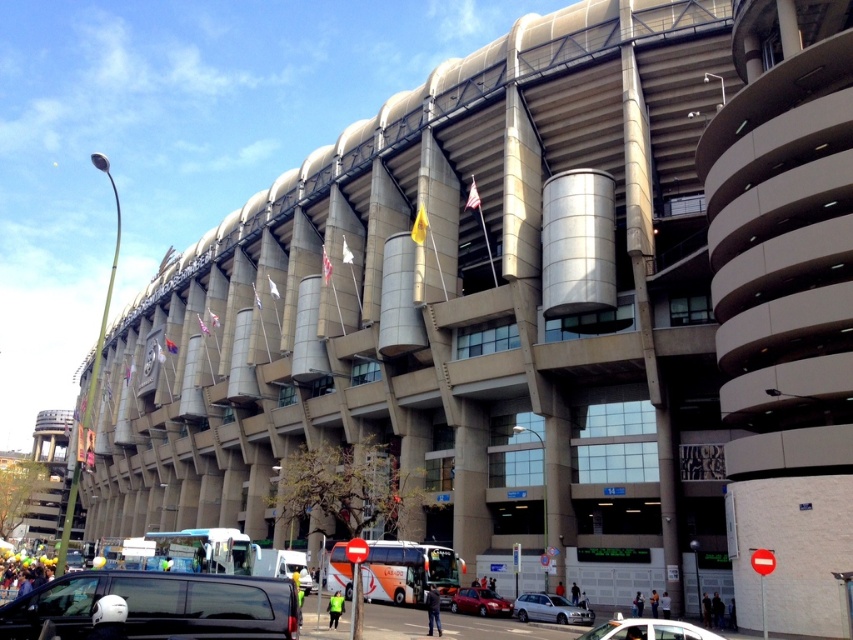
At what (x,y) coordinates should I click in order to perform the action: click on black matte van at lower left. Please return your answer as a coordinate pair (x, y). Looking at the image, I should click on (160, 605).

Is point (213, 620) positioned in front of point (538, 608)?

Yes.

Which is behind, point (82, 577) or point (575, 620)?

The point (575, 620) is behind.

Find the location of a particular element. The image size is (853, 640). black matte van at lower left is located at coordinates (x=160, y=605).

Consider the image. Is silver metallic sedan at center behind metallic red sedan at lower center?

No, it is not.

Is point (537, 616) positioned before point (473, 592)?

Yes, point (537, 616) is closer to viewer.

Find the location of `silver metallic sedan at center`. silver metallic sedan at center is located at coordinates [x=549, y=609].

Can you confirm if black matte van at lower left is positioned to the left of metallic red sedan at lower center?

Correct, you'll find black matte van at lower left to the left of metallic red sedan at lower center.

Is point (178, 602) positioned behind point (474, 612)?

No, (178, 602) is closer to viewer.

Is point (252, 588) in front of point (457, 608)?

Yes.

This screenshot has width=853, height=640. Identify the location of black matte van at lower left. (160, 605).